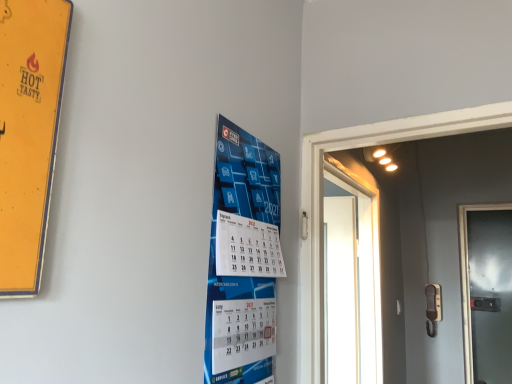
The width and height of the screenshot is (512, 384). What do you see at coordinates (433, 308) in the screenshot? I see `beige matte door handle at right` at bounding box center [433, 308].

The image size is (512, 384). I want to click on metallic glass door at right, which is the 2th door in left-to-right order, so click(x=486, y=291).

Find the location of a particular element. The height and width of the screenshot is (384, 512). white glossy door at right, the 1th door positioned from the front is located at coordinates [x=350, y=284].

What do you see at coordinates (350, 284) in the screenshot?
I see `white glossy door at right, the 1th door positioned from the front` at bounding box center [350, 284].

This screenshot has width=512, height=384. Find the location of `beige matte door handle at right`. beige matte door handle at right is located at coordinates (433, 308).

Where is `the 2nd door behind when counting from the blue paper calendar at center`? the 2nd door behind when counting from the blue paper calendar at center is located at coordinates (486, 291).

Does blue paper calendar at center turn towards metallic glass door at right, the first door positioned from the back?

No, blue paper calendar at center is not turned towards metallic glass door at right, the first door positioned from the back.

Looking at this image, visually, is blue paper calendar at center positioned to the left or to the right of metallic glass door at right, the 1th door from the right?

Clearly, blue paper calendar at center is on the left of metallic glass door at right, the 1th door from the right, in the image.

From the image's perspective, which object appears higher, beige matte door handle at right or blue paper calendar at center?

From the image's view, blue paper calendar at center is above.

Considering the sizes of beige matte door handle at right and blue paper calendar at center in the image, is beige matte door handle at right bigger or smaller than blue paper calendar at center?

Considering their sizes, beige matte door handle at right takes up less space than blue paper calendar at center.

Between beige matte door handle at right and blue paper calendar at center, which one has smaller width?

With smaller width is blue paper calendar at center.

How distant is beige matte door handle at right from blue paper calendar at center?

beige matte door handle at right is 1.93 meters away from blue paper calendar at center.

Would you say blue paper calendar at center is inside or outside beige matte door handle at right?

blue paper calendar at center exists outside the volume of beige matte door handle at right.

Between blue paper calendar at center and beige matte door handle at right, which one has smaller width?

Thinner between the two is blue paper calendar at center.

Which is in front, blue paper calendar at center or beige matte door handle at right?

Positioned in front is blue paper calendar at center.

Does blue paper calendar at center appear on the right side of beige matte door handle at right?

In fact, blue paper calendar at center is to the left of beige matte door handle at right.

Is metallic glass door at right, the 1th door from the right, oriented towards blue paper calendar at center?

No, metallic glass door at right, the 1th door from the right, is not aimed at blue paper calendar at center.

Is point (482, 372) closer or farther from the camera than point (261, 278)?

Point (482, 372).

Is metallic glass door at right, the first door positioned from the back, further to camera compared to blue paper calendar at center?

That is True.

I want to click on door handle beneath the metallic glass door at right, the 1th door from the right (from a real-world perspective), so [433, 308].

From the picture: What's the angular difference between metallic glass door at right, which is the 2th door in left-to-right order, and beige matte door handle at right's facing directions?

The facing directions of metallic glass door at right, which is the 2th door in left-to-right order, and beige matte door handle at right are 0.000283 degrees apart.

Which object is positioned more to the left, metallic glass door at right, the 2th door viewed from the front, or beige matte door handle at right?

beige matte door handle at right.

Considering their positions, is metallic glass door at right, the 2th door viewed from the front, located in front of or behind beige matte door handle at right?

In the image, metallic glass door at right, the 2th door viewed from the front, appears in front of beige matte door handle at right.

The image size is (512, 384). I want to click on door that is the 1st one when counting rightward from the blue paper calendar at center, so click(350, 284).

Considering the relative sizes of white glossy door at right, the 1th door positioned from the front, and blue paper calendar at center in the image provided, is white glossy door at right, the 1th door positioned from the front, bigger than blue paper calendar at center?

Indeed, white glossy door at right, the 1th door positioned from the front, has a larger size compared to blue paper calendar at center.

Is white glossy door at right, which is the second door from right to left, in front of or behind blue paper calendar at center in the image?

white glossy door at right, which is the second door from right to left, is behind blue paper calendar at center.

Which object is wider, white glossy door at right, which is the first door in left-to-right order, or blue paper calendar at center?

Wider between the two is white glossy door at right, which is the first door in left-to-right order.

How different are the orientations of beige matte door handle at right and metallic glass door at right, the 1th door from the right, in degrees?

0.000283 degrees separate the facing orientations of beige matte door handle at right and metallic glass door at right, the 1th door from the right.

Is beige matte door handle at right with metallic glass door at right, which is the 2th door in left-to-right order?

beige matte door handle at right and metallic glass door at right, which is the 2th door in left-to-right order, are not in contact.

I want to click on the 1st door in front of the beige matte door handle at right, so click(x=486, y=291).

Find the location of a particular element. The image size is (512, 384). poster to the left of metallic glass door at right, the first door positioned from the back is located at coordinates (243, 260).

Identify the location of door handle that appears behind the blue paper calendar at center. (433, 308).

Based on their spatial positions, is blue paper calendar at center or white glossy door at right, arranged as the 2th door when viewed from the back, closer to metallic glass door at right, the first door positioned from the back?

white glossy door at right, arranged as the 2th door when viewed from the back, is closer to metallic glass door at right, the first door positioned from the back.

From the picture: From the image, which object appears to be nearer to white glossy door at right, the 1th door positioned from the front, blue paper calendar at center or beige matte door handle at right?

Among the two, beige matte door handle at right is located nearer to white glossy door at right, the 1th door positioned from the front.

Looking at this image, from the image, which object appears to be nearer to white glossy door at right, arranged as the 2th door when viewed from the back, blue paper calendar at center or metallic glass door at right, the 2th door viewed from the front?

metallic glass door at right, the 2th door viewed from the front, lies closer to white glossy door at right, arranged as the 2th door when viewed from the back, than the other object.

Based on their spatial positions, is white glossy door at right, the 1th door positioned from the front, or beige matte door handle at right closer to metallic glass door at right, which is the 2th door in left-to-right order?

beige matte door handle at right.

Considering their positions, is beige matte door handle at right positioned closer to white glossy door at right, which is the first door in left-to-right order, than blue paper calendar at center?

The object closer to white glossy door at right, which is the first door in left-to-right order, is beige matte door handle at right.

Estimate the real-world distances between objects in this image. Which object is further from blue paper calendar at center, metallic glass door at right, the first door positioned from the back, or beige matte door handle at right?

Among the two, metallic glass door at right, the first door positioned from the back, is located further to blue paper calendar at center.

From the image, which object appears to be farther from white glossy door at right, which is the first door in left-to-right order, metallic glass door at right, the first door positioned from the back, or beige matte door handle at right?

Based on the image, metallic glass door at right, the first door positioned from the back, appears to be further to white glossy door at right, which is the first door in left-to-right order.

Considering their positions, is white glossy door at right, which is the first door in left-to-right order, positioned further to blue paper calendar at center than metallic glass door at right, the 2th door viewed from the front?

Based on the image, metallic glass door at right, the 2th door viewed from the front, appears to be further to blue paper calendar at center.

At what (x,y) coordinates should I click in order to perform the action: click on door positioned between white glossy door at right, which is the second door from right to left, and beige matte door handle at right from near to far. Please return your answer as a coordinate pair (x, y). Looking at the image, I should click on tap(486, 291).

Image resolution: width=512 pixels, height=384 pixels. I want to click on door between blue paper calendar at center and metallic glass door at right, the 2th door viewed from the front, from front to back, so click(350, 284).